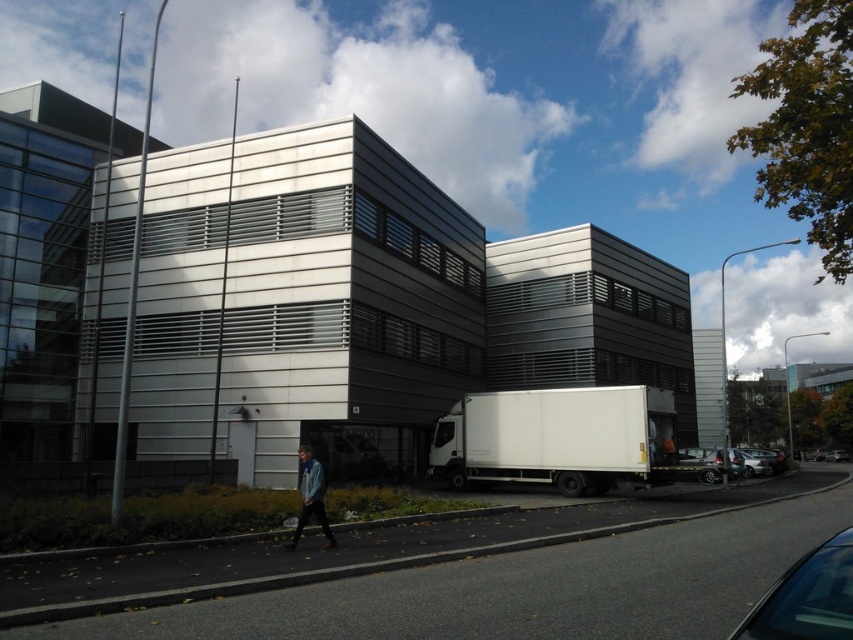
You are a pedestrian standing at the crosswalk. You see the white matte trailer truck at center and the shiny black car at lower right. Which one is closer to you?

The shiny black car at lower right is closer to you because it is only 18.02 meters away from the white matte trailer truck at center, which is farther away.

You are standing at the point labeled as point (x=807, y=596) in the image. What object is located at that position?

The point (x=807, y=596) indicates a shiny black car at lower right.

You are a pedestrian standing on the sidewalk and want to cross the street to reach the shiny black car at lower right and the metallic silver car at lower right. Which car is closer to you?

The shiny black car at lower right is closer to you than the metallic silver car at lower right.